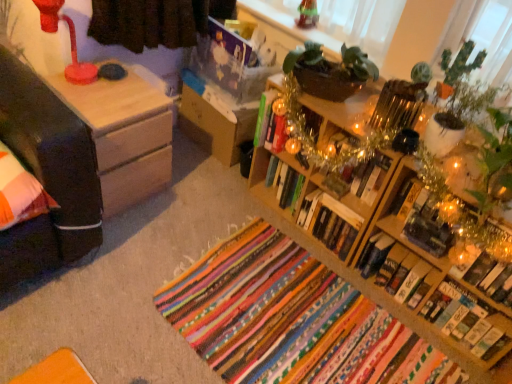
The width and height of the screenshot is (512, 384). What are the coordinates of `free location to the left of hardcover book at center-right, marked as the 3th book in a left-to-right arrangement` in the screenshot? It's located at (342, 283).